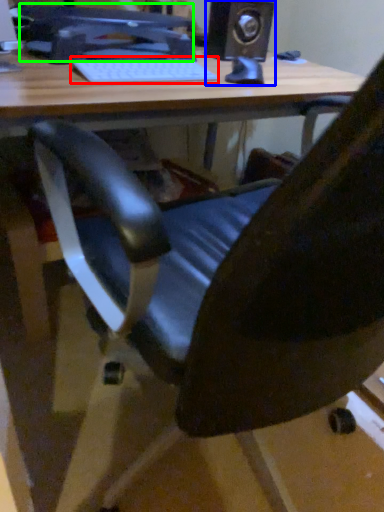
Question: Which object is positioned closest to laptop keyboard (highlighted by a red box)? Select from speaker (highlighted by a blue box) and computer monitor (highlighted by a green box).

Choices:
 (A) speaker
 (B) computer monitor

Answer: (B)